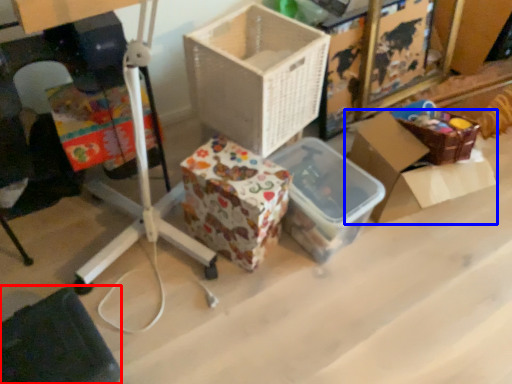
Question: Which object appears farthest to the camera in this image, wide (highlighted by a red box) or box (highlighted by a blue box)?

Choices:
 (A) wide
 (B) box

Answer: (B)